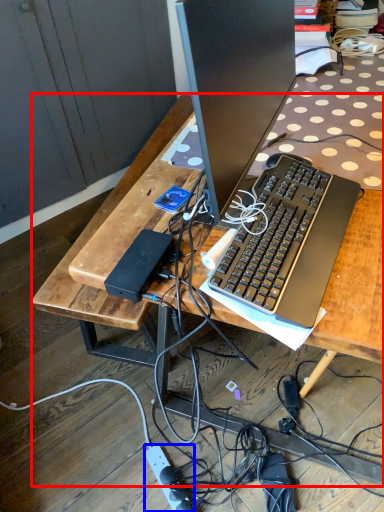
Question: Among these objects, which one is farthest to the camera, desk (highlighted by a red box) or power outlet (highlighted by a blue box)?

Choices:
 (A) desk
 (B) power outlet

Answer: (B)